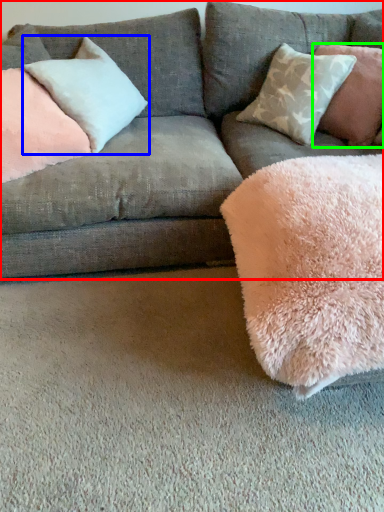
Question: Which is farther away from studio couch (highlighted by a red box)? pillow (highlighted by a blue box) or pillow (highlighted by a green box)?

Choices:
 (A) pillow
 (B) pillow

Answer: (B)